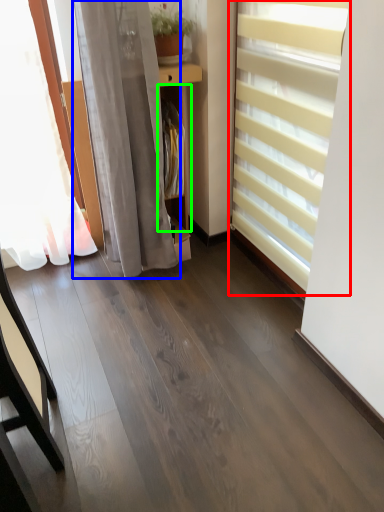
Question: Considering the real-world distances, which object is farthest from window blind (highlighted by a red box)? curtain (highlighted by a blue box) or shelf (highlighted by a green box)?

Choices:
 (A) curtain
 (B) shelf

Answer: (A)